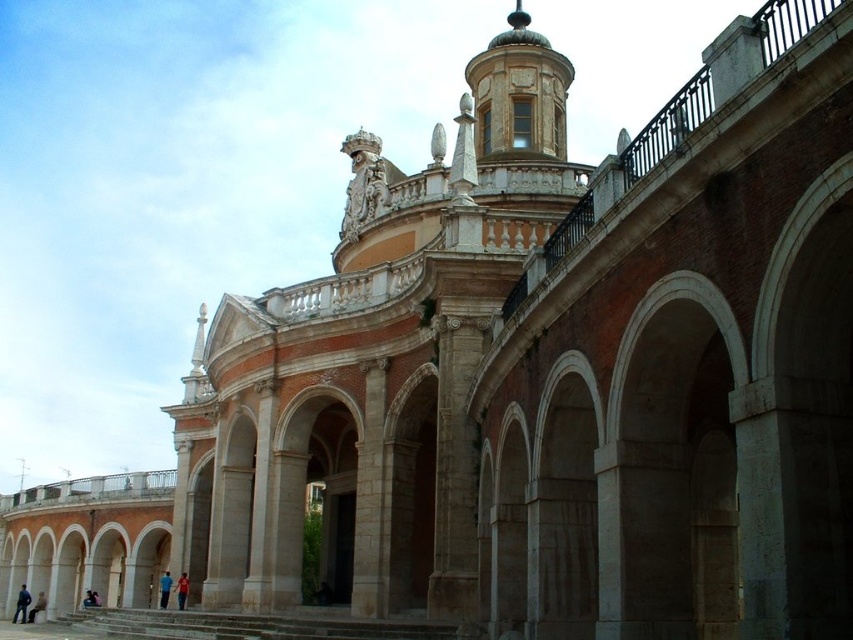
Does point (167, 589) lie behind point (181, 596)?

Yes, point (167, 589) is behind point (181, 596).

Between blue fabric person at lower center and red shirt at lower center, which one appears on the left side from the viewer's perspective?

blue fabric person at lower center is more to the left.

In order to click on blue fabric person at lower center in this screenshot , I will do `click(164, 588)`.

Does blue denim jeans at lower left have a lesser width compared to blue fabric person at lower center?

No.

Does blue denim jeans at lower left appear over blue fabric person at lower center?

No.

Locate an element on the screen. blue denim jeans at lower left is located at coordinates (21, 604).

Where is `blue denim jeans at lower left`? This screenshot has width=853, height=640. blue denim jeans at lower left is located at coordinates (21, 604).

Between blue denim jeans at lower left and light brown leather jacket at lower left, which one appears on the left side from the viewer's perspective?

From the viewer's perspective, blue denim jeans at lower left appears more on the left side.

Who is more forward, (22, 598) or (38, 595)?

Point (22, 598) is more forward.

Who is more forward, (15, 620) or (35, 611)?

Point (35, 611) is more forward.

This screenshot has height=640, width=853. In order to click on blue denim jeans at lower left in this screenshot , I will do `click(21, 604)`.